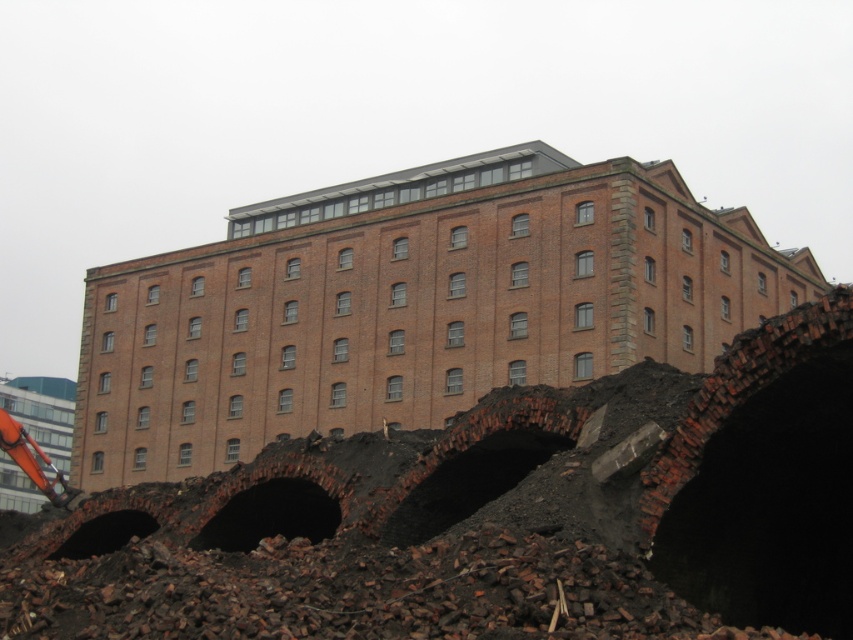
Question: Based on their relative distances, which object is farther from the dark brown stone hole at lower left?

Choices:
 (A) exposed brick rubble at center
 (B) dark brick hole at center

Answer: (A)

Question: Is the position of exposed brick rubble at center more distant than that of dark brown stone hole at lower left?

Choices:
 (A) no
 (B) yes

Answer: (B)

Question: Observing the image, what is the correct spatial positioning of exposed brick rubble at center in reference to dark brick hole at center?

Choices:
 (A) right
 (B) left

Answer: (A)

Question: Estimate the real-world distances between objects in this image. Which object is closer to the dark brown stone hole at lower left?

Choices:
 (A) exposed brick rubble at center
 (B) dark brick hole at center

Answer: (B)

Question: Does exposed brick rubble at center have a larger size compared to dark brown stone hole at lower left?

Choices:
 (A) yes
 (B) no

Answer: (A)

Question: Based on their relative distances, which object is farther from the dark brown stone hole at lower left?

Choices:
 (A) exposed brick rubble at center
 (B) dark brick hole at center

Answer: (A)